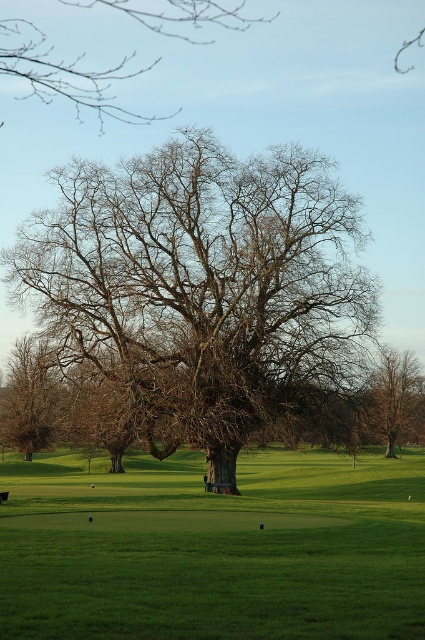
You are standing in the middle of the lawn and want to walk towards the brown leafless tree at right. Which direction should you walk to avoid the bare branches at upper left first?

To avoid the bare branches at upper left first, you should walk towards the brown leafless tree at right by moving to the right side of the bare branches at upper left, since the brown leafless tree at right is further away and the bare branches at upper left are closer to you.

You are a landscape architect designing a new park. You need to place a 10 meter long bench between the bare wood oak tree at center and the bare branches at upper left. Is there enough space to place the bench between them?

The distance between the bare wood oak tree at center and the bare branches at upper left is 13.80 meters, so yes, the 10 meter long bench can be placed between them since the space is larger than the bench.